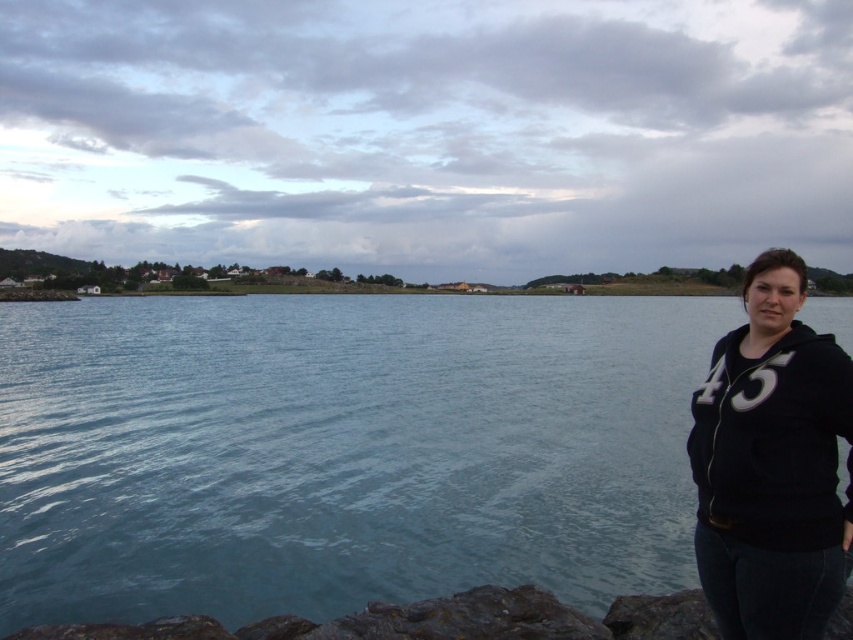
You are standing at the lakeside and want to take a photo of the blue water at center and the rusty rock at lower left. Which object appears taller in the photo?

The blue water at center appears taller than the rusty rock at lower left in the photo because the blue water at center has a greater height compared to the rusty rock at lower left according to the description.

In the scene shown: You are standing on the rocky shoreline and want to place a 3 meter long wooden board between the blue water at center and the black fleece at right. Is there enough space between them to place the board horizontally?

The blue water at center is 24.10 meters away from the black fleece at right, so yes, the 3 meter long wooden board can be placed horizontally between them since the distance is sufficient.